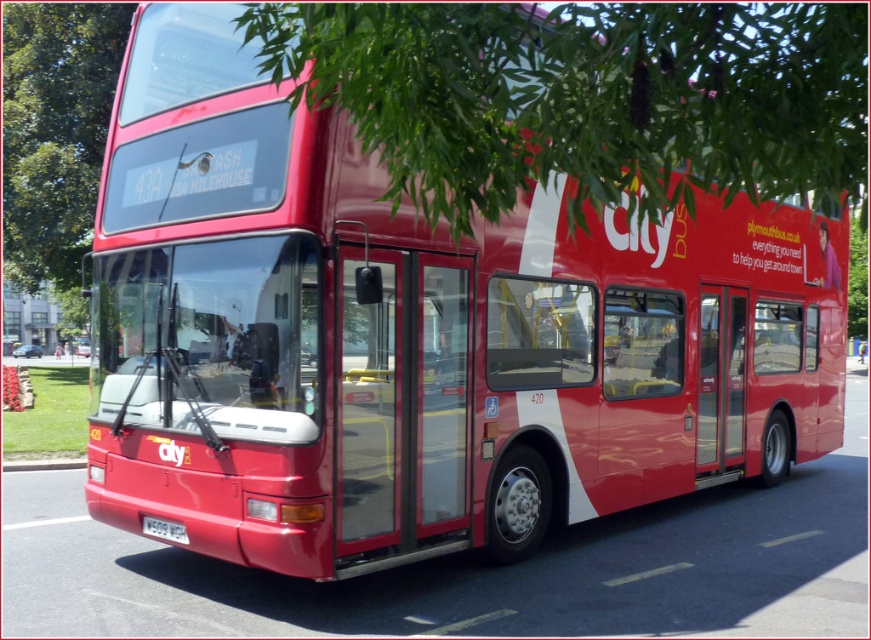
Question: Which point is closer to the camera?

Choices:
 (A) (490, 106)
 (B) (152, 524)

Answer: (A)

Question: Can you confirm if green leafy tree at upper center is positioned above white plastic license plate at lower center?

Choices:
 (A) yes
 (B) no

Answer: (A)

Question: Which of the following is the closest to the observer?

Choices:
 (A) green leafy tree at upper center
 (B) white plastic license plate at lower center

Answer: (A)

Question: Does green leafy tree at upper center have a greater width compared to white plastic license plate at lower center?

Choices:
 (A) no
 (B) yes

Answer: (B)

Question: Which point is farther from the camera taking this photo?

Choices:
 (A) (161, 522)
 (B) (512, 200)

Answer: (A)

Question: Where is green leafy tree at upper center located in relation to white plastic license plate at lower center in the image?

Choices:
 (A) right
 (B) left

Answer: (A)